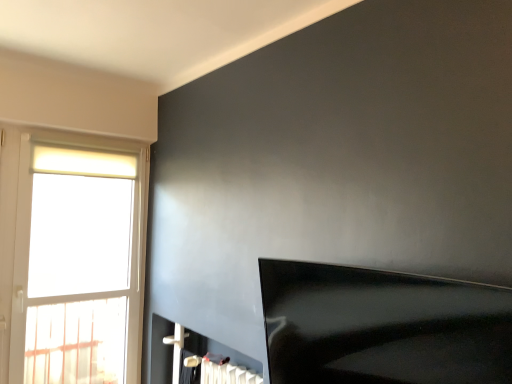
Question: Considering the relative sizes of white glass window at left and black glossy tv at lower right in the image provided, is white glass window at left wider than black glossy tv at lower right?

Choices:
 (A) no
 (B) yes

Answer: (A)

Question: From the image's perspective, does white glass window at left appear higher than black glossy tv at lower right?

Choices:
 (A) yes
 (B) no

Answer: (A)

Question: Is white glass window at left shorter than black glossy tv at lower right?

Choices:
 (A) no
 (B) yes

Answer: (A)

Question: From the image's perspective, is white glass window at left under black glossy tv at lower right?

Choices:
 (A) no
 (B) yes

Answer: (A)

Question: Is black glossy tv at lower right inside white glass window at left?

Choices:
 (A) yes
 (B) no

Answer: (B)

Question: In the image, is black glossy tv at lower right on the left side or the right side of white glass window at left?

Choices:
 (A) right
 (B) left

Answer: (A)

Question: Is black glossy tv at lower right in front of or behind white glass window at left in the image?

Choices:
 (A) behind
 (B) front

Answer: (B)

Question: In terms of height, does black glossy tv at lower right look taller or shorter compared to white glass window at left?

Choices:
 (A) short
 (B) tall

Answer: (A)

Question: In terms of width, does black glossy tv at lower right look wider or thinner when compared to white glass window at left?

Choices:
 (A) wide
 (B) thin

Answer: (A)

Question: Considering the positions of white glass window at left and black glossy tv at lower right in the image, is white glass window at left wider or thinner than black glossy tv at lower right?

Choices:
 (A) wide
 (B) thin

Answer: (B)

Question: Visually, is white glass window at left positioned to the left or to the right of black glossy tv at lower right?

Choices:
 (A) right
 (B) left

Answer: (B)

Question: Is white glass window at left inside or outside of black glossy tv at lower right?

Choices:
 (A) outside
 (B) inside

Answer: (A)

Question: In terms of height, does white glass window at left look taller or shorter compared to black glossy tv at lower right?

Choices:
 (A) short
 (B) tall

Answer: (B)

Question: Is white glass window at left to the left or to the right of white glossy fireplace at lower center in the image?

Choices:
 (A) left
 (B) right

Answer: (A)

Question: Is white glass window at left taller or shorter than white glossy fireplace at lower center?

Choices:
 (A) short
 (B) tall

Answer: (B)